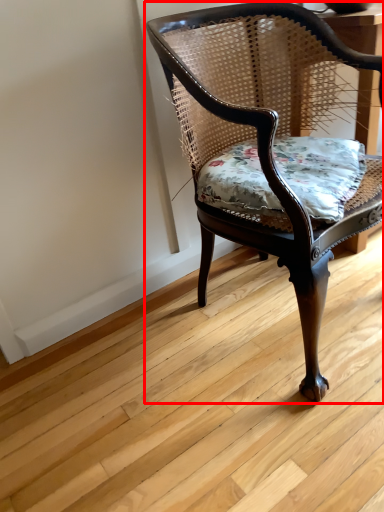
Question: From the image's perspective, what is the correct spatial relationship of chair (annotated by the red box) in relation to pillow?

Choices:
 (A) above
 (B) below

Answer: (B)